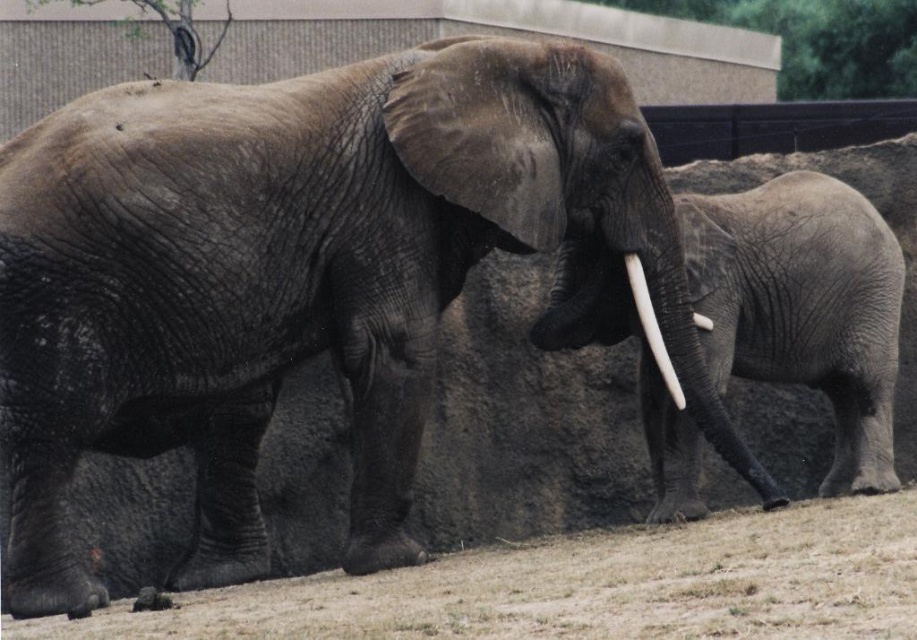
You are standing in the zoo enclosure looking at the two elephants. You notice a point marked at coordinates (804,305). Which elephant does this point correspond to?

The point marked at coordinates (804,305) corresponds to the gray wrinkled skin elephant at right.